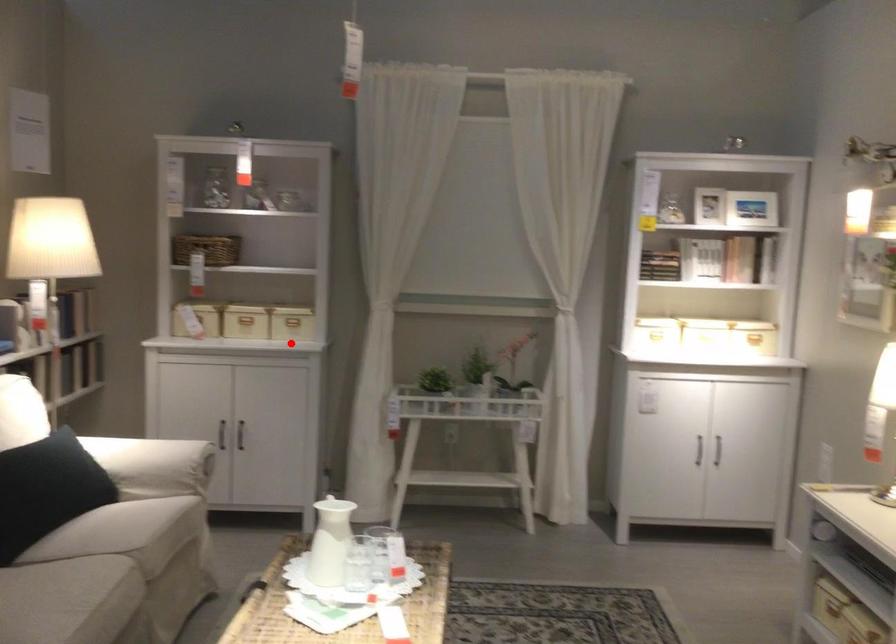
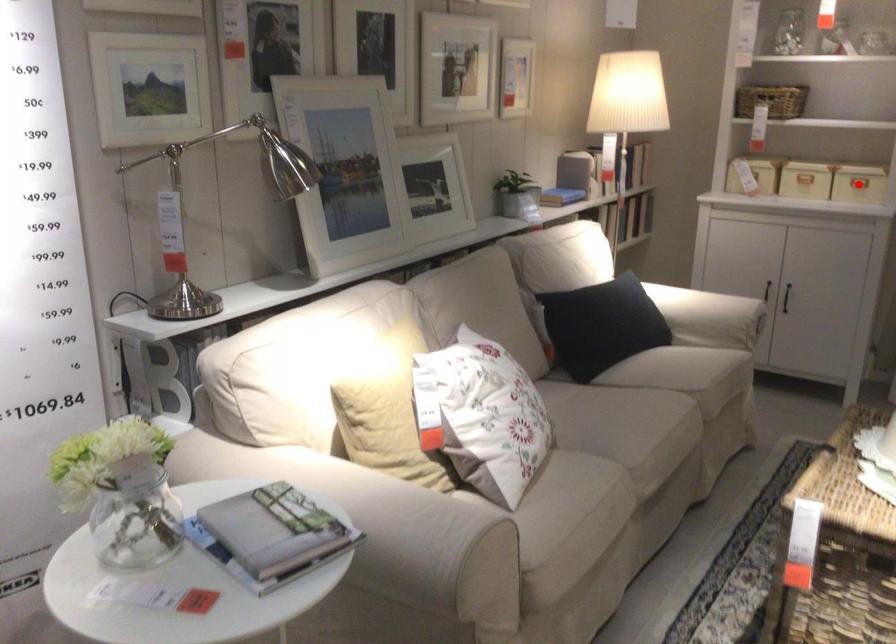
I am providing you with two images of the same scene from different viewpoints. A red point is marked on the first image and another point is marked on the second image. Does the point marked in image1 correspond to the same location as the one in image2?

Yes